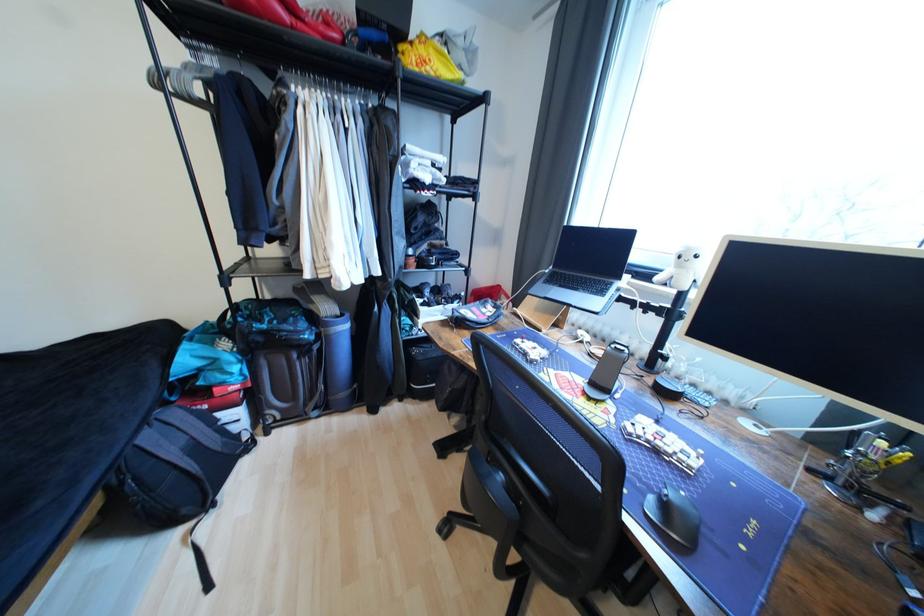
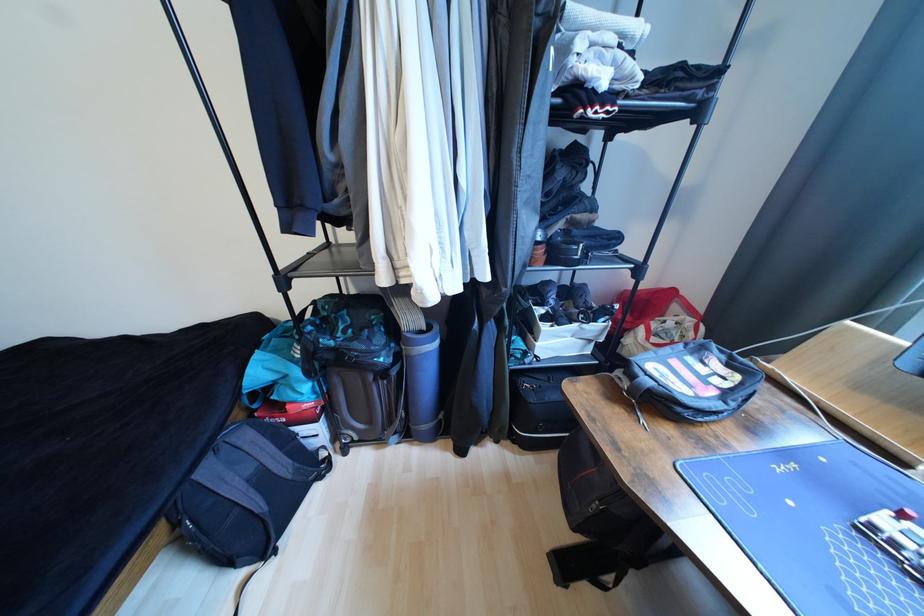
Question: The camera is either moving clockwise (left) or counter-clockwise (right) around the object. The first image is from the beginning of the video and the second image is from the end. Is the camera moving left or right when shooting the video?

Choices:
 (A) Left
 (B) Right

Answer: (B)